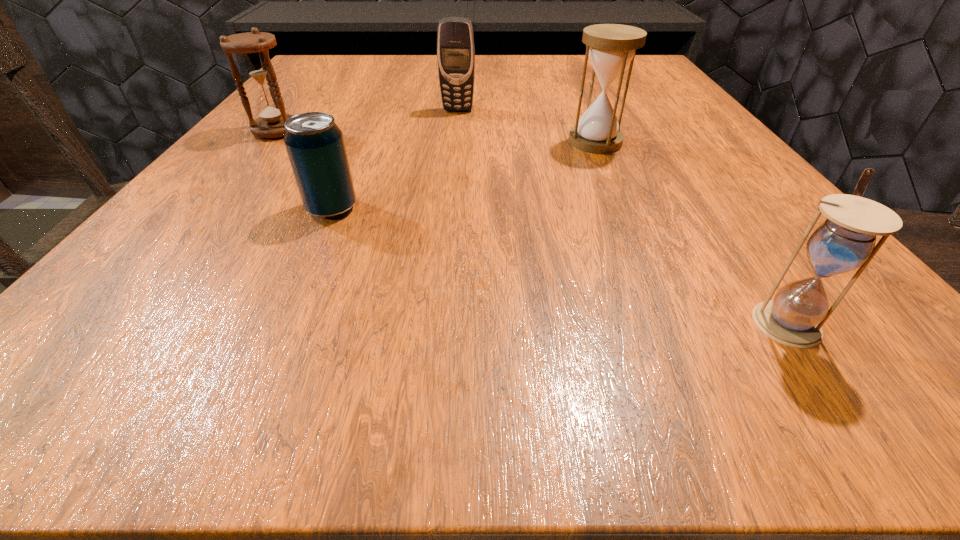
Locate an element on the screen. The width and height of the screenshot is (960, 540). free space that is in between the shortest object and the rightmost object is located at coordinates (559, 265).

Identify which object is located as the second nearest to the shortest object. Please provide its 2D coordinates. Your answer should be formatted as a tuple, i.e. [(x, y)], where the tuple contains the x and y coordinates of a point satisfying the conditions above.

[(455, 41)]

Locate which object is the closest to the cellular telephone. Please provide its 2D coordinates. Your answer should be formatted as a tuple, i.e. [(x, y)], where the tuple contains the x and y coordinates of a point satisfying the conditions above.

[(611, 47)]

Identify which hourglass is located as the second nearest to the rightmost hourglass. Please provide its 2D coordinates. Your answer should be formatted as a tuple, i.e. [(x, y)], where the tuple contains the x and y coordinates of a point satisfying the conditions above.

[(253, 47)]

Find the location of `hourglass that stands as the closest to the fourth object from left to right`. hourglass that stands as the closest to the fourth object from left to right is located at coordinates (846, 240).

This screenshot has height=540, width=960. I want to click on free spot that satisfies the following two spatial constraints: 1. on the front side of the fourth object from right to left; 2. on the left side of the leftmost hourglass, so click(214, 208).